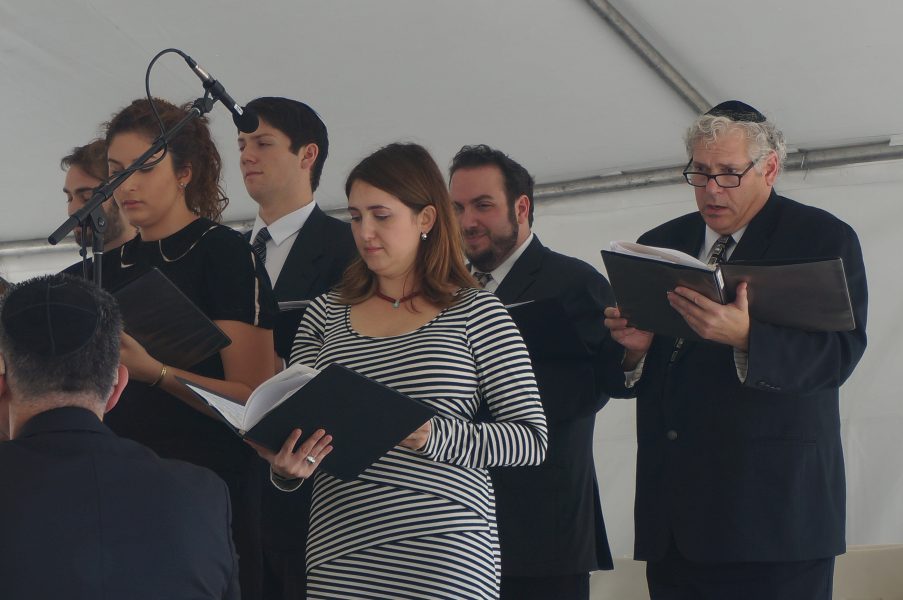
Identify the location of books. The width and height of the screenshot is (903, 600). (323, 419), (170, 313), (644, 283), (523, 308).